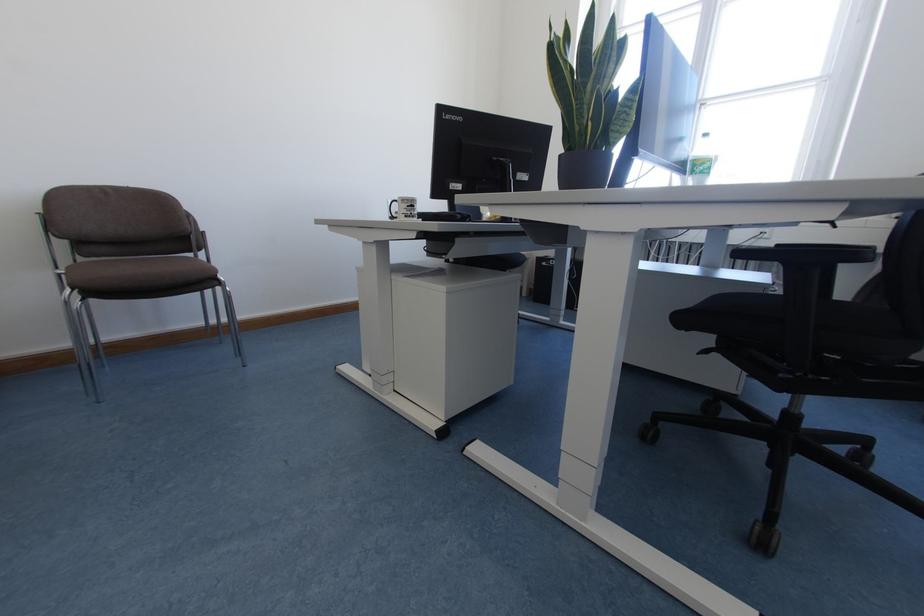
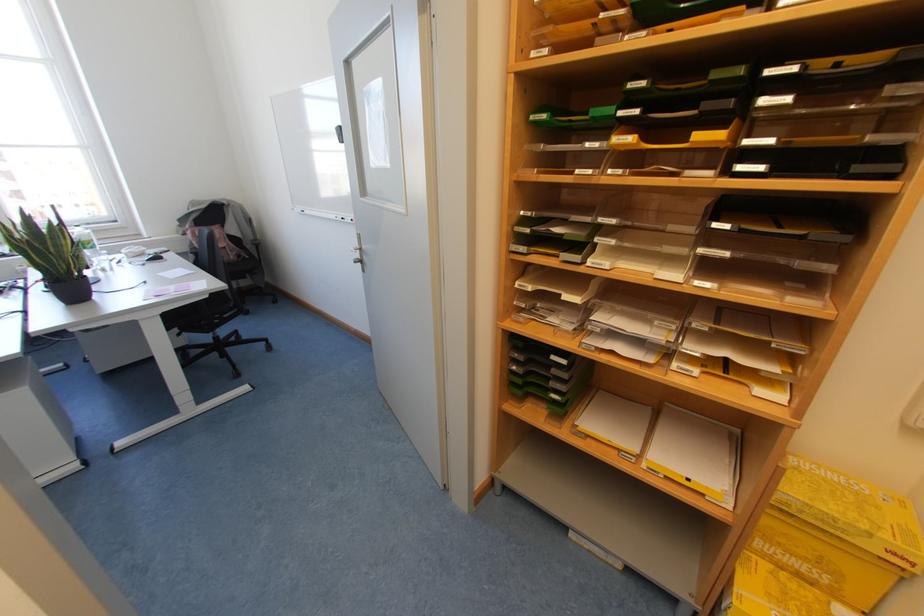
Locate, in the second image, the point that corresponds to point 767,445 in the first image.

(215, 351)